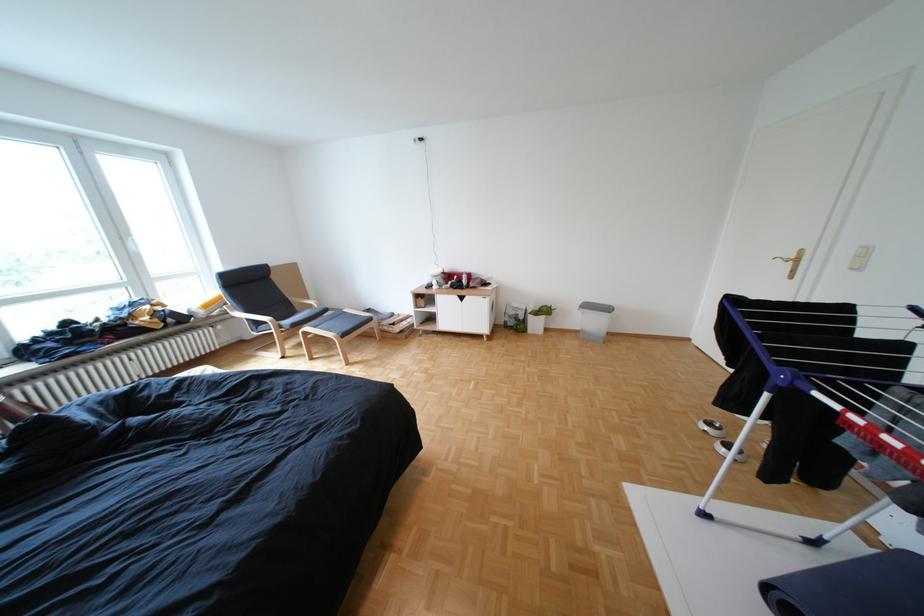
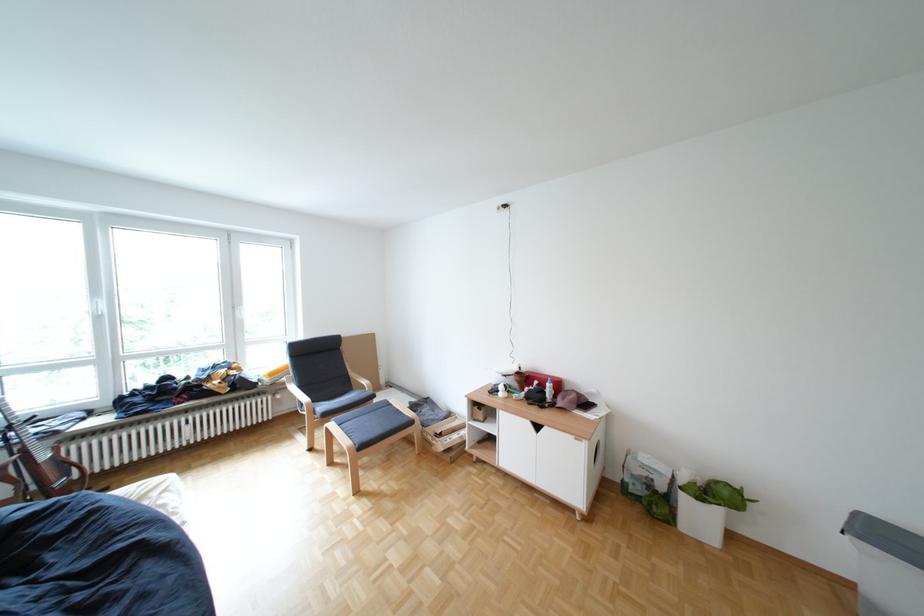
Find the pixel in the second image that matches [470,277] in the first image.

(552, 383)